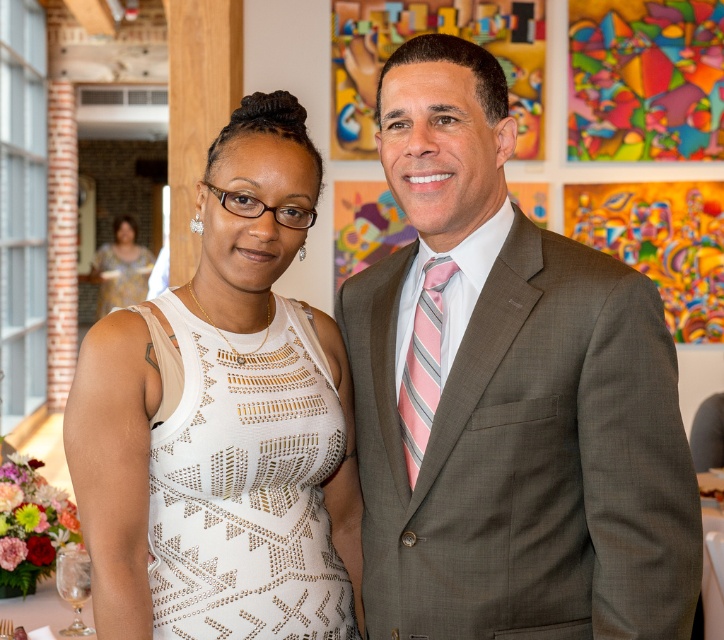
Can you confirm if gray suit at center is positioned above white textured dress at center?

Yes, gray suit at center is above white textured dress at center.

Which is below, gray suit at center or white textured dress at center?

white textured dress at center

This screenshot has height=640, width=724. What are the coordinates of `gray suit at center` in the screenshot? It's located at (508, 397).

Is point (174, 497) farther from camera compared to point (424, 269)?

No, (174, 497) is closer to viewer.

The image size is (724, 640). Find the location of `white textured dress at center`. white textured dress at center is located at coordinates (243, 481).

Describe the element at coordinates (243, 481) in the screenshot. This screenshot has width=724, height=640. I see `white textured dress at center` at that location.

The height and width of the screenshot is (640, 724). I want to click on white textured dress at center, so click(x=243, y=481).

Is gray suit at center taller than white textured dress at upper left?

Incorrect, gray suit at center's height is not larger of white textured dress at upper left's.

Is gray suit at center above white textured dress at upper left?

Actually, gray suit at center is below white textured dress at upper left.

Which is in front, point (513, 452) or point (114, 275)?

Point (513, 452) is more forward.

The width and height of the screenshot is (724, 640). In order to click on gray suit at center in this screenshot , I will do `click(508, 397)`.